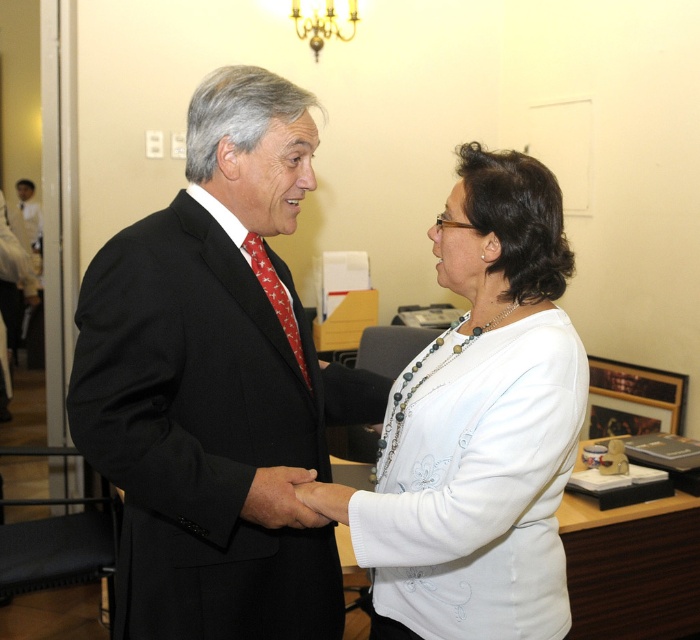
Does white matte sweater at center appear on the left side of smooth skin hand at center?

Incorrect, white matte sweater at center is not on the left side of smooth skin hand at center.

Measure the distance between point (476, 556) and camera.

Point (476, 556) and camera are 4.14 feet apart from each other.

Locate an element on the screen. white matte sweater at center is located at coordinates (482, 426).

How much distance is there between smooth skin hand at center and white matte hand at center?

They are 1.46 inches apart.

How distant is smooth skin hand at center from white matte hand at center?

1.46 inches

Locate an element on the screen. This screenshot has width=700, height=640. smooth skin hand at center is located at coordinates (280, 499).

Find the location of a particular element. Image resolution: width=700 pixels, height=640 pixels. smooth skin hand at center is located at coordinates (280, 499).

Does black suit at center appear on the left side of white matte hand at center?

Indeed, black suit at center is positioned on the left side of white matte hand at center.

In the scene shown: Who is more forward, (x=127, y=300) or (x=336, y=500)?

Point (x=127, y=300) is in front.

Find the location of a particular element. black suit at center is located at coordinates (214, 381).